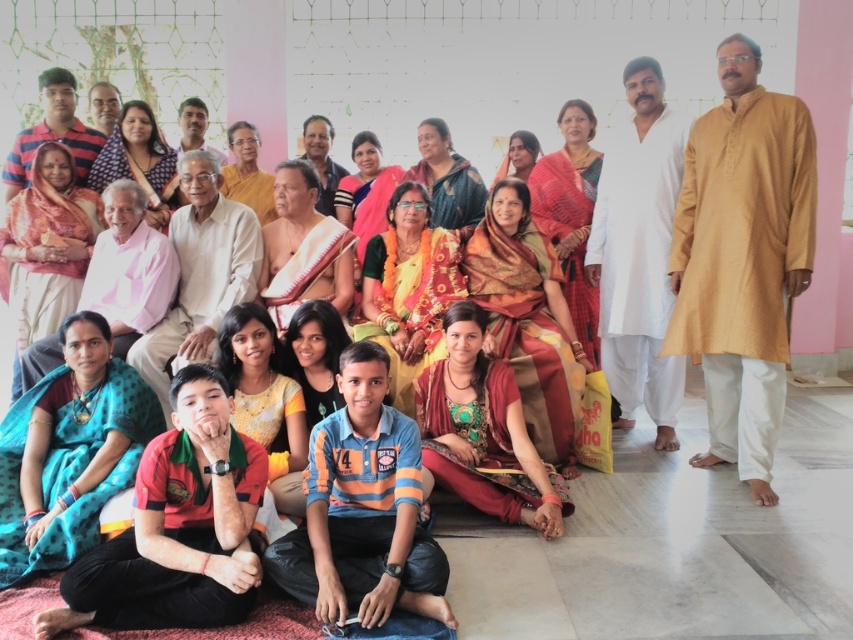
Is matte pink saree at lower left positioned in front of matte pink saree at center?

Yes, matte pink saree at lower left is closer to the viewer.

Between point (45, 320) and point (149, 212), which one is positioned behind?

Positioned behind is point (149, 212).

You are a GUI agent. You are given a task and a screenshot of the screen. Output one action in this format:
    pyautogui.click(x=<x>, y=<y>)
    Task: Click on the matte pink saree at lower left
    This screenshot has height=640, width=853.
    Given the screenshot: What is the action you would take?
    pyautogui.click(x=48, y=246)

Locate an element on the screen. matte pink saree at lower left is located at coordinates (48, 246).

Which of these two, matte orange saree at center or matte black shirt at center, stands shorter?

matte black shirt at center

Between point (506, 240) and point (328, 387), which one is positioned in front?

Point (328, 387) is in front.

Which is in front, point (523, 328) or point (325, 413)?

Positioned in front is point (325, 413).

This screenshot has height=640, width=853. What are the coordinates of `matte orange saree at center` in the screenshot? It's located at (527, 320).

Who is lower down, silky orange saree at center or matte pink saree at center?

Positioned lower is silky orange saree at center.

Can you confirm if silky orange saree at center is positioned above matte pink saree at center?

Actually, silky orange saree at center is below matte pink saree at center.

The width and height of the screenshot is (853, 640). What do you see at coordinates (483, 429) in the screenshot?
I see `silky orange saree at center` at bounding box center [483, 429].

Locate an element on the screen. The height and width of the screenshot is (640, 853). silky orange saree at center is located at coordinates (483, 429).